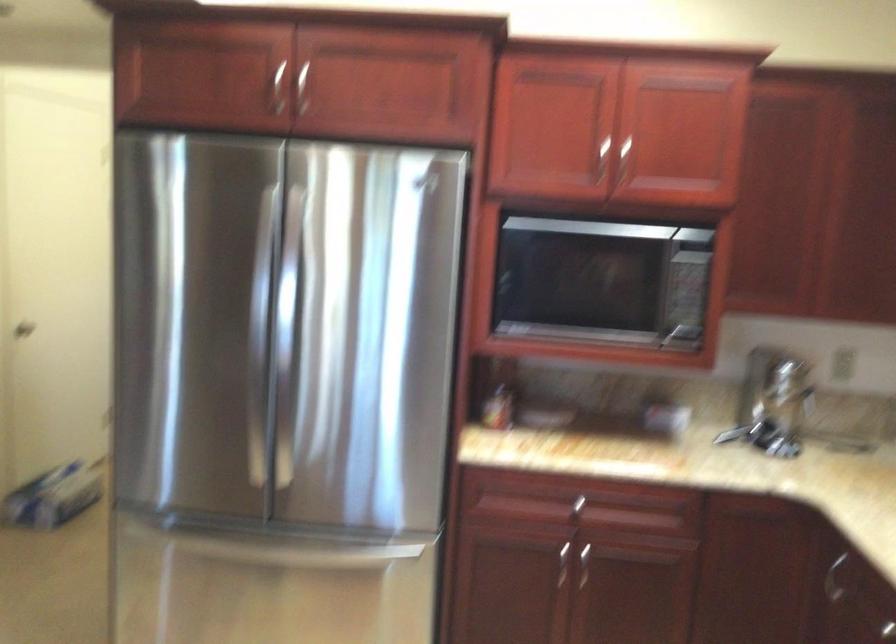
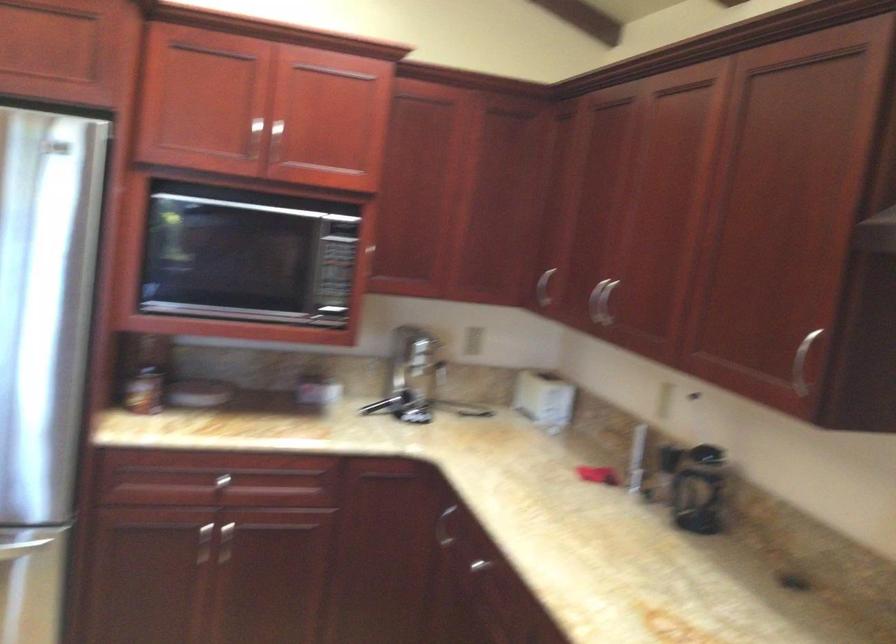
The point at (599, 156) is marked in the first image. Where is the corresponding point in the second image?

(254, 138)